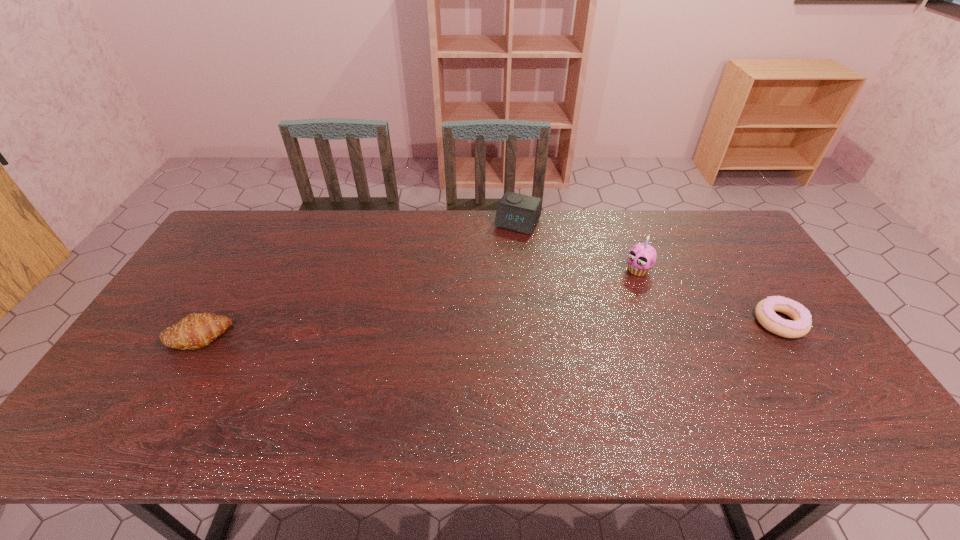
Locate an element on the screen. vacant point located between the doughnut and the crescent roll is located at coordinates (488, 329).

Find the location of `vacant space in between the cupcake and the alarm clock`. vacant space in between the cupcake and the alarm clock is located at coordinates (578, 247).

Where is `free point between the rightmost object and the farthest object`? free point between the rightmost object and the farthest object is located at coordinates (649, 273).

At what (x,y) coordinates should I click in order to perform the action: click on vacant space that is in between the third shortest object and the third object from left to right. Please return your answer as a coordinate pair (x, y). Looking at the image, I should click on (578, 247).

Image resolution: width=960 pixels, height=540 pixels. I want to click on free space between the doughnut and the second tallest object, so click(x=649, y=273).

Locate an element on the screen. This screenshot has width=960, height=540. object that is the closest one to the shortest object is located at coordinates click(641, 257).

Where is `object that is the second closest to the third object from left to right`? The image size is (960, 540). object that is the second closest to the third object from left to right is located at coordinates (516, 212).

I want to click on vacant region that satisfies the following two spatial constraints: 1. on the back side of the crescent roll; 2. on the right side of the second farthest object, so click(x=235, y=271).